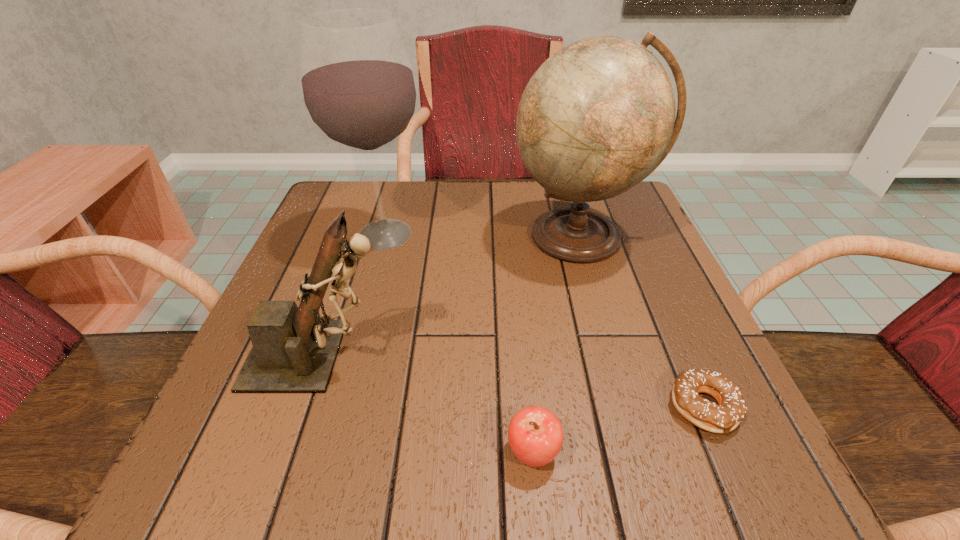
Where is `alcohol`? This screenshot has height=540, width=960. alcohol is located at coordinates (359, 91).

The height and width of the screenshot is (540, 960). Find the location of `globe`. globe is located at coordinates (598, 116).

Find the location of a particular element. The width and height of the screenshot is (960, 540). figurine is located at coordinates pos(294,350).

You are a GUI agent. You are given a task and a screenshot of the screen. Output one action in this format:
    pyautogui.click(x=<x>, y=<y>)
    Task: Click on the fourth tallest object
    This screenshot has width=960, height=540.
    Given the screenshot: What is the action you would take?
    pyautogui.click(x=535, y=434)

Find the location of a particular element. doughnut is located at coordinates (725, 417).

Where is `vacant area situated 0.110m on the right of the alcohol`? vacant area situated 0.110m on the right of the alcohol is located at coordinates (482, 235).

Where is `vacant space located 0.290m on the front-facing side of the globe`? The image size is (960, 540). vacant space located 0.290m on the front-facing side of the globe is located at coordinates [631, 414].

This screenshot has width=960, height=540. I want to click on vacant area situated on the front-facing side of the figurine, so click(x=557, y=355).

The width and height of the screenshot is (960, 540). I want to click on vacant space located on the back of the apple, so click(x=514, y=250).

Image resolution: width=960 pixels, height=540 pixels. I want to click on vacant space located on the left of the shortest object, so click(542, 408).